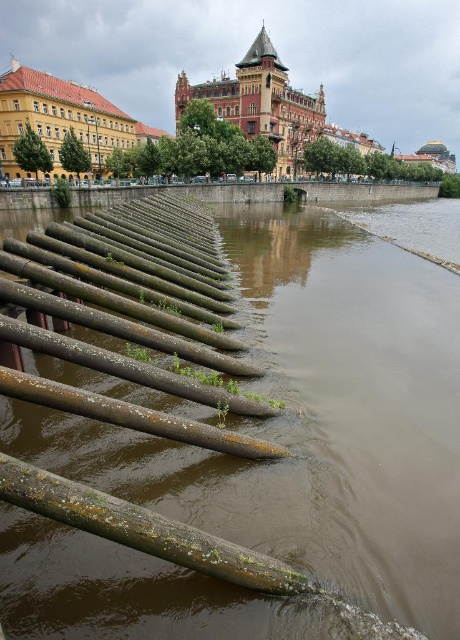
You are standing at the riverside and see the brown concrete river at lower left and the green mossy log at lower left. Which object is closer to your right side?

The brown concrete river at lower left is positioned on the right side of green mossy log at lower left, so it is closer to your right side.

You are standing at the riverside and want to place a small potted plant between the brown concrete river at lower left and the green mossy log at lower left. Which object should you place it closer to if you want the plant to be near the larger object?

You should place the small potted plant closer to the brown concrete river at lower left because it is larger than the green mossy log at lower left.

You are standing at the riverside and want to place a small potted plant between the brown concrete river at lower left and the green mossy log at lower left. Which object should you place it closer to if you want it to be more visible to someone approaching from the front?

You should place the potted plant closer to the brown concrete river at lower left because it is closer to the viewer than the green mossy log at lower left, making it more visible to someone approaching from the front.